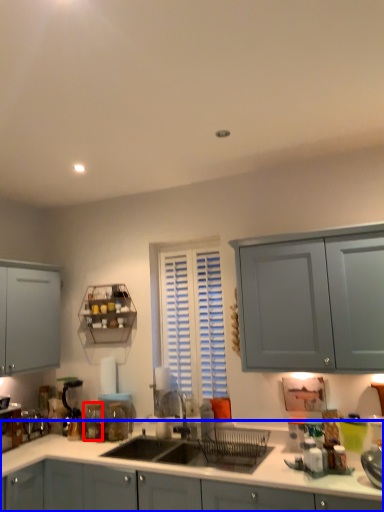
Question: Which object appears farthest to the camera in this image, glass jar (highlighted by a red box) or cabinetry (highlighted by a blue box)?

Choices:
 (A) glass jar
 (B) cabinetry

Answer: (A)